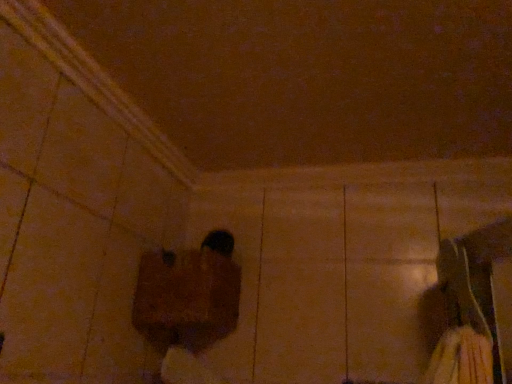
Question: Is wooden block at lower center placed right next to black matte shoe at center?

Choices:
 (A) no
 (B) yes

Answer: (A)

Question: Does wooden block at lower center come behind black matte shoe at center?

Choices:
 (A) yes
 (B) no

Answer: (B)

Question: From a real-world perspective, is wooden block at lower center over black matte shoe at center?

Choices:
 (A) no
 (B) yes

Answer: (A)

Question: Can we say wooden block at lower center lies outside black matte shoe at center?

Choices:
 (A) yes
 (B) no

Answer: (A)

Question: Does wooden block at lower center have a larger size compared to black matte shoe at center?

Choices:
 (A) no
 (B) yes

Answer: (B)

Question: Does wooden block at lower center have a greater height compared to black matte shoe at center?

Choices:
 (A) yes
 (B) no

Answer: (A)

Question: From a real-world perspective, is black matte shoe at center positioned under wooden block at lower center based on gravity?

Choices:
 (A) no
 (B) yes

Answer: (A)

Question: Is black matte shoe at center bigger than wooden block at lower center?

Choices:
 (A) yes
 (B) no

Answer: (B)

Question: Is black matte shoe at center not within wooden block at lower center?

Choices:
 (A) yes
 (B) no

Answer: (A)

Question: Does black matte shoe at center have a greater width compared to wooden block at lower center?

Choices:
 (A) yes
 (B) no

Answer: (B)

Question: Is black matte shoe at center with wooden block at lower center?

Choices:
 (A) no
 (B) yes

Answer: (A)

Question: Is black matte shoe at center to the right of wooden block at lower center from the viewer's perspective?

Choices:
 (A) no
 (B) yes

Answer: (B)

Question: Is black matte shoe at center inside the boundaries of wooden block at lower center, or outside?

Choices:
 (A) inside
 (B) outside

Answer: (B)